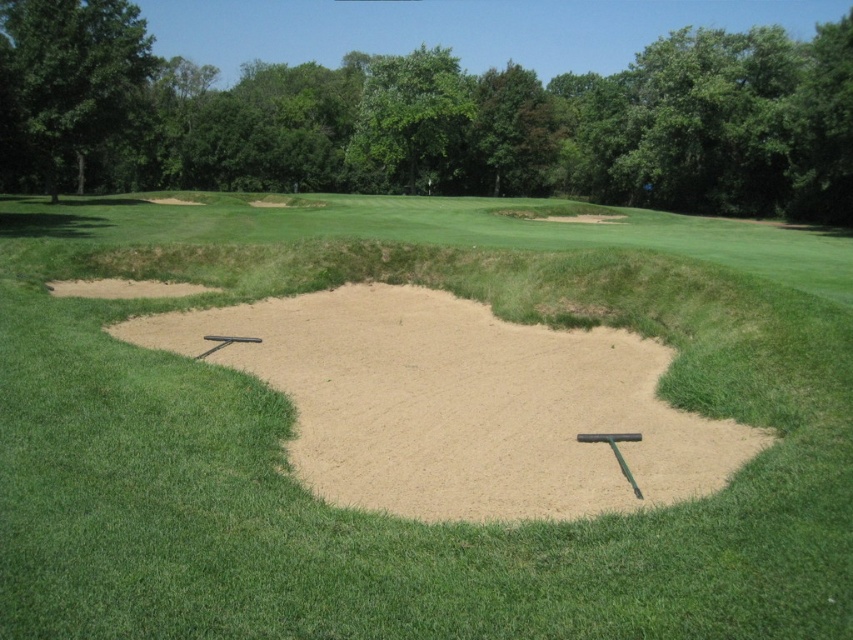
You are a golfer who has just hit your ball into the sand trap. You notice the smooth sand trap at center and the smooth sand at center. Which one is more likely to give your ball a stable landing?

The smooth sand at center is more likely to give your ball a stable landing because it is finer and more compact compared to the sand trap at center, which has uneven edges and patches of grass.

You are a golfer who has just hit your ball into the sand trap. You see the smooth sand trap at center and the smooth sand at center. Which one is located to the left?

The smooth sand trap at center is to the left of the smooth sand at center.

You are a golfer trying to determine the best path to avoid the sand trap. Given that the smooth sand trap at center is wider than the smooth sand at center, which area should you aim for to stay clear of the sand?

The smooth sand at center has a smaller width compared to the smooth sand trap at center, so aiming for the smooth sand at center would keep you away from the wider sand trap.